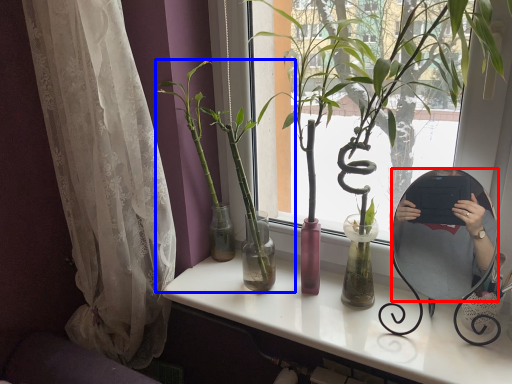
Question: Which point is closer to the camera, mirror (highlighted by a red box) or houseplant (highlighted by a blue box)?

Choices:
 (A) mirror
 (B) houseplant

Answer: (A)